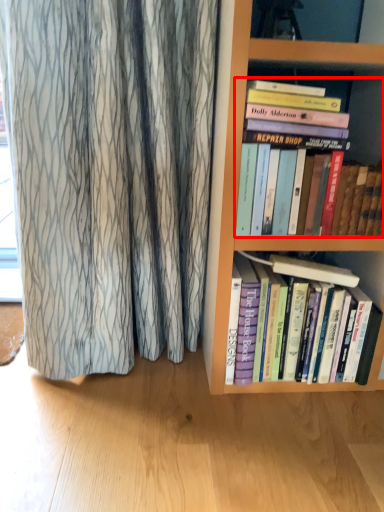
Question: From the image's perspective, considering the relative positions of book (annotated by the red box) and book in the image provided, where is book (annotated by the red box) located with respect to the staircase?

Choices:
 (A) below
 (B) above

Answer: (B)